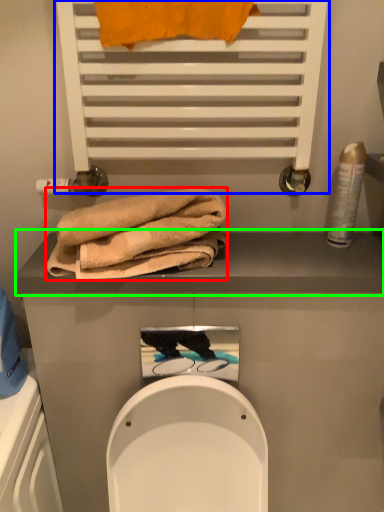
Question: Which is nearer to the towel (highlighted by a red box)? shelf (highlighted by a blue box) or balustrade (highlighted by a green box).

Choices:
 (A) shelf
 (B) balustrade

Answer: (B)